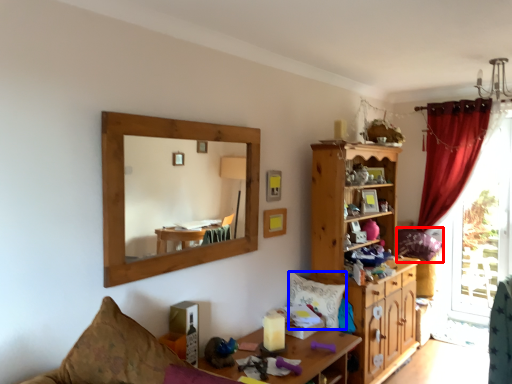
Question: Which point is closer to the camera, pillow (highlighted by a red box) or pillow (highlighted by a blue box)?

Choices:
 (A) pillow
 (B) pillow

Answer: (B)